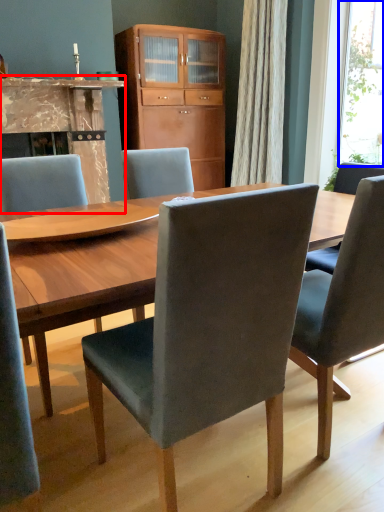
Question: Which object is further to the camera taking this photo, fireplace (highlighted by a red box) or window screen (highlighted by a blue box)?

Choices:
 (A) fireplace
 (B) window screen

Answer: (B)